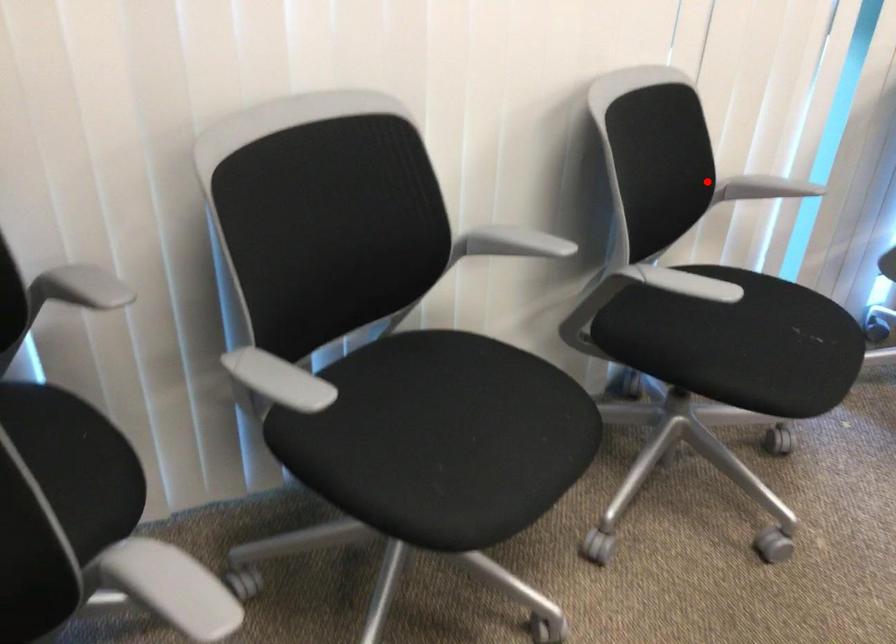
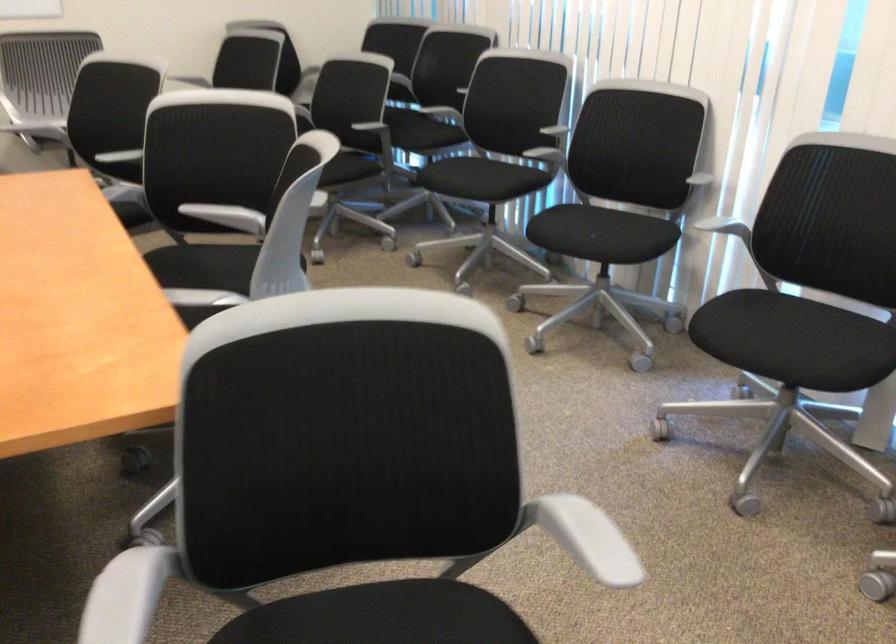
Question: I am providing you with two images of the same scene from different viewpoints. In image1, a red point is highlighted. Considering the same 3D point in image2, which of the following is correct?

Choices:
 (A) It is closer
 (B) It is farther

Answer: (B)